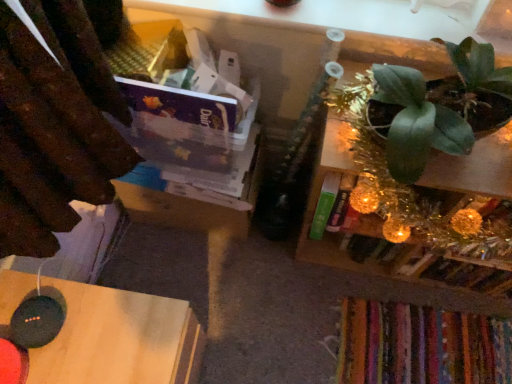
Question: From the image's perspective, is green metallic plant at upper right positioned above or below black wood table at lower left?

Choices:
 (A) below
 (B) above

Answer: (B)

Question: Would you say green metallic plant at upper right is to the left or to the right of black wood table at lower left in the picture?

Choices:
 (A) right
 (B) left

Answer: (A)

Question: Estimate the real-world distances between objects in this image. Which object is farther from the green metallic plant at upper right?

Choices:
 (A) black wood table at lower left
 (B) green matte plant at upper right

Answer: (A)

Question: Estimate the real-world distances between objects in this image. Which object is farther from the green matte plant at upper right?

Choices:
 (A) black wood table at lower left
 (B) green metallic plant at upper right

Answer: (A)